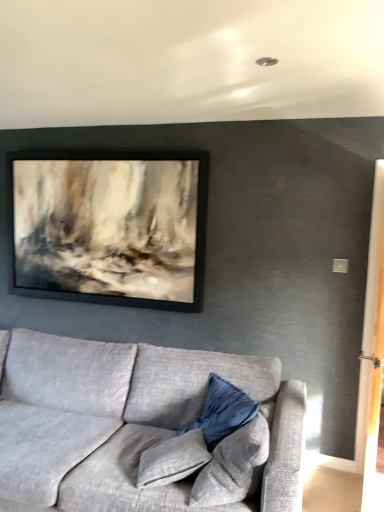
Question: From the image's perspective, is velvet blue pillow at center, arranged as the 2th pillow when viewed from the front, under velvet blue pillow at lower center, the 1th pillow in the front-to-back sequence?

Choices:
 (A) no
 (B) yes

Answer: (B)

Question: Is the depth of velvet blue pillow at center, placed as the 1th pillow when sorted from back to front, greater than that of velvet blue pillow at lower center, the 1th pillow in the front-to-back sequence?

Choices:
 (A) yes
 (B) no

Answer: (A)

Question: Does velvet blue pillow at center, placed as the 1th pillow when sorted from back to front, have a lesser height compared to velvet blue pillow at lower center, the 2th pillow viewed from the back?

Choices:
 (A) yes
 (B) no

Answer: (A)

Question: From a real-world perspective, is velvet blue pillow at center, arranged as the 2th pillow when viewed from the front, beneath velvet blue pillow at lower center, the 1th pillow in the front-to-back sequence?

Choices:
 (A) no
 (B) yes

Answer: (B)

Question: From the image's perspective, is velvet blue pillow at center, placed as the 1th pillow when sorted from back to front, on top of velvet blue pillow at lower center, the 1th pillow in the front-to-back sequence?

Choices:
 (A) yes
 (B) no

Answer: (B)

Question: Is there a large distance between velvet blue pillow at center, placed as the 1th pillow when sorted from back to front, and velvet blue pillow at lower center, the 1th pillow in the front-to-back sequence?

Choices:
 (A) yes
 (B) no

Answer: (B)

Question: Is the position of velvet blue pillow at center, arranged as the 2th pillow when viewed from the front, less distant than that of textured gray couch at lower left?

Choices:
 (A) no
 (B) yes

Answer: (A)

Question: Is velvet blue pillow at center, arranged as the 2th pillow when viewed from the front, oriented towards textured gray couch at lower left?

Choices:
 (A) no
 (B) yes

Answer: (B)

Question: Is textured gray couch at lower left at the back of velvet blue pillow at center, arranged as the 2th pillow when viewed from the front?

Choices:
 (A) no
 (B) yes

Answer: (B)

Question: Does velvet blue pillow at center, arranged as the 2th pillow when viewed from the front, have a greater width compared to textured gray couch at lower left?

Choices:
 (A) no
 (B) yes

Answer: (A)

Question: Is velvet blue pillow at center, arranged as the 2th pillow when viewed from the front, taller than textured gray couch at lower left?

Choices:
 (A) yes
 (B) no

Answer: (B)

Question: From the image's perspective, is velvet blue pillow at center, placed as the 1th pillow when sorted from back to front, beneath textured gray couch at lower left?

Choices:
 (A) yes
 (B) no

Answer: (B)

Question: Can you confirm if velvet blue pillow at lower center, the 1th pillow in the front-to-back sequence, is bigger than velvet blue pillow at center, arranged as the 2th pillow when viewed from the front?

Choices:
 (A) no
 (B) yes

Answer: (B)